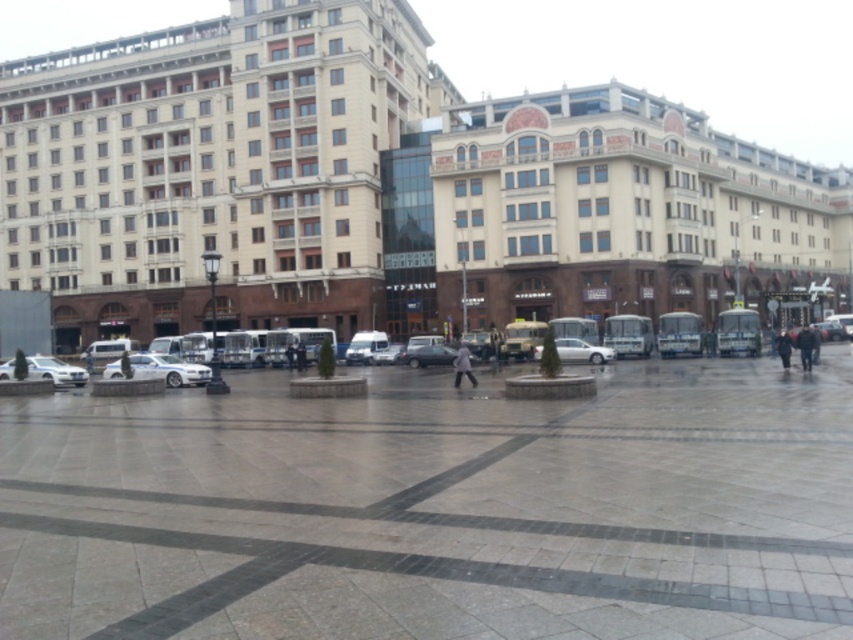
Question: Which is nearer to the smooth stone pavement at center?

Choices:
 (A) dark gray fabric jacket at lower right
 (B) silver metallic car at lower left
 (C) matte gray car at center

Answer: (B)

Question: Estimate the real-world distances between objects in this image. Which object is closer to the silver metallic car at center?

Choices:
 (A) matte gray car at center
 (B) silver metallic car at lower left
 (C) smooth stone pavement at center
 (D) white matte car at center

Answer: (B)

Question: Considering the relative positions of smooth stone pavement at center and white matte jacket at center in the image provided, where is smooth stone pavement at center located with respect to white matte jacket at center?

Choices:
 (A) left
 (B) right

Answer: (A)

Question: Which object is the farthest from the matte gray car at center?

Choices:
 (A) silver metallic car at lower left
 (B) dark gray jacket at center
 (C) metallic silver sedan at center
 (D) white matte jacket at center

Answer: (A)

Question: Is smooth stone pavement at center positioned at the back of dark gray fabric jacket at lower right?

Choices:
 (A) no
 (B) yes

Answer: (A)

Question: Does silver metallic car at lower left have a smaller size compared to white matte jacket at center?

Choices:
 (A) no
 (B) yes

Answer: (A)